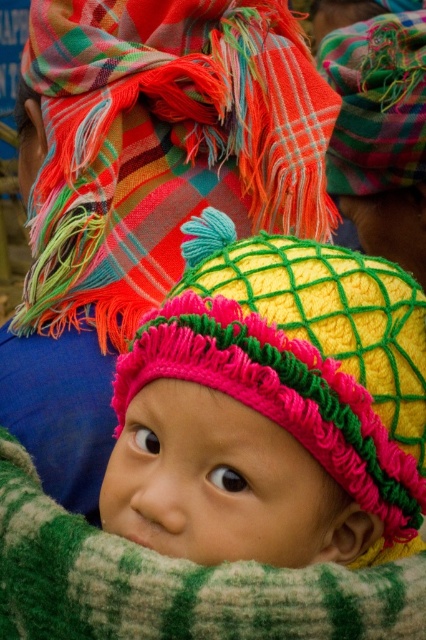
You are a tailor trying to decide which item to place in a small gift box. The knitted yellow hat at center and the multicolored woven scarf at upper center are both options. Based on their sizes, which one would fit better in the box?

The knitted yellow hat at center has a smaller size compared to the multicolored woven scarf at upper center, so it would fit better in the small gift box.

You are a photographer taking a picture of the baby wearing the hat with the turquoise flower. You notice a point at coordinates (163,147). Where is this point located in the scene?

The point at coordinates (163,147) is on the multicolored woven scarf at upper center.

What are the coordinates of the knitted yellow hat at center?

The knitted yellow hat at center is located at coordinates point (273, 406).